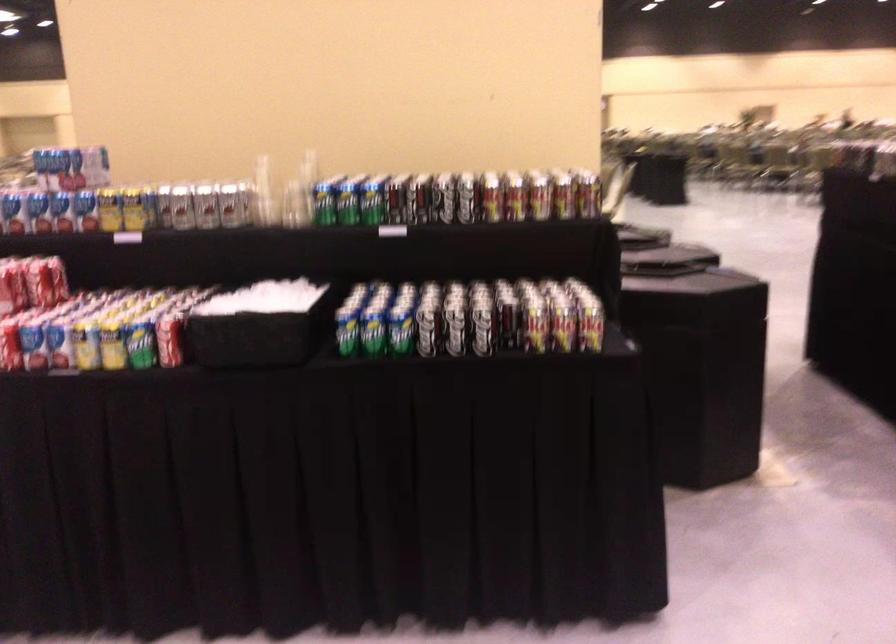
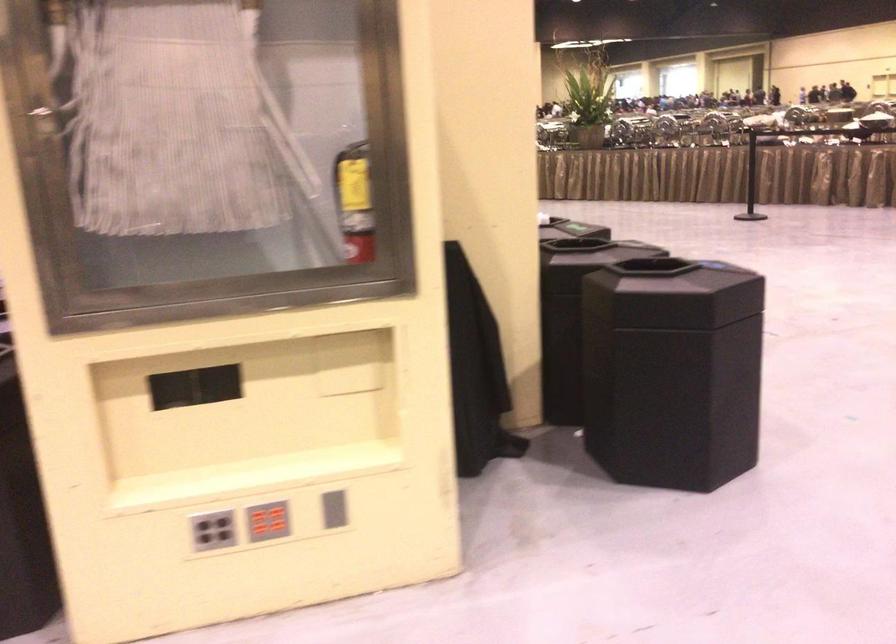
Question: I am providing you with two images of the same scene from different viewpoints. Please identify which objects are invisible in image2.

Choices:
 (A) black trash can lid
 (B) yellow soda can
 (C) woven storage bag
 (D) grey vertical slot

Answer: (B)